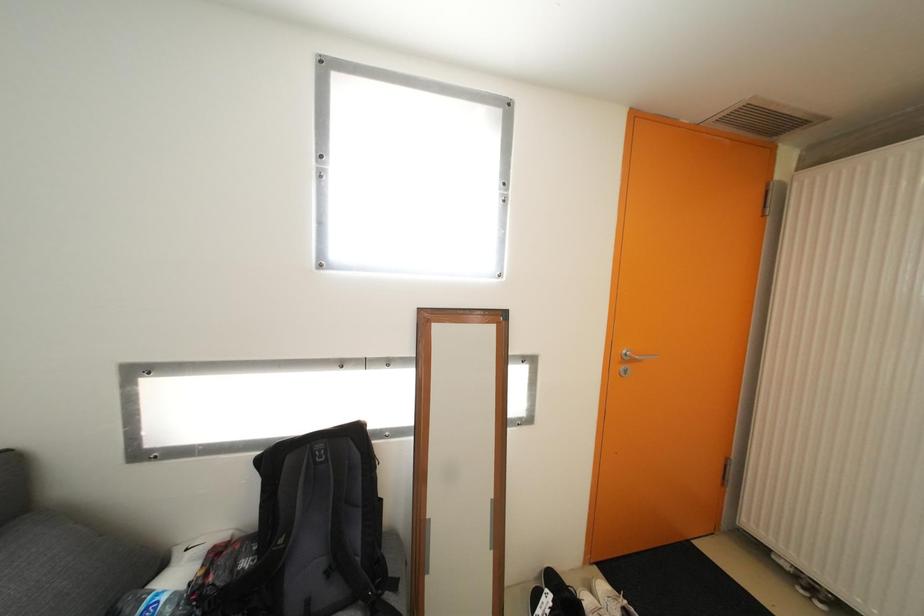
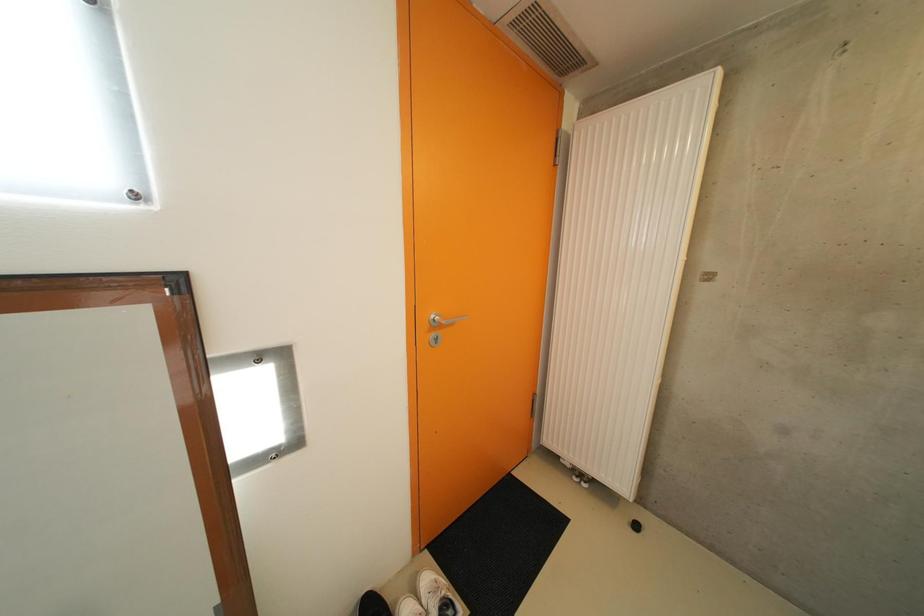
What movement of the cameraman would produce the second image?

The movement direction of the cameraman is right, forward.